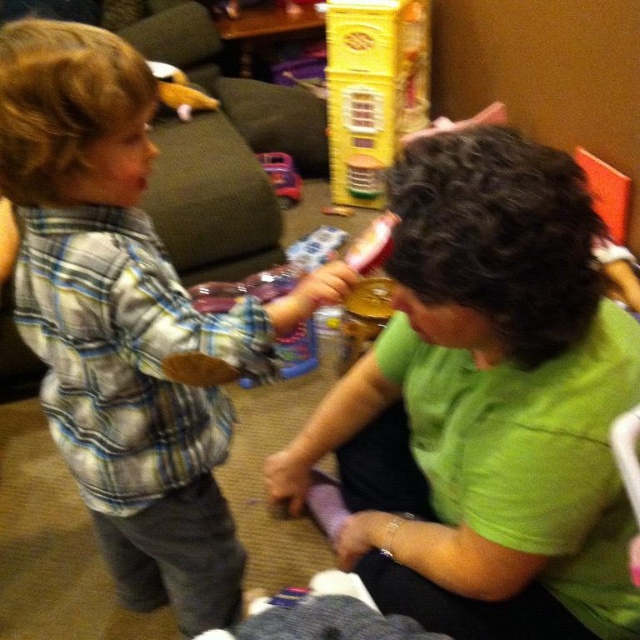
Question: Which of these objects is positioned closest to the plastic toy car at center?

Choices:
 (A) yellow plastic dollhouse at upper center
 (B) plaid cotton shirt at left
 (C) green matte shirt at center

Answer: (A)

Question: Which point appears closest to the camera in this image?

Choices:
 (A) (554, 504)
 (B) (365, 202)
 (C) (144, 538)
 (D) (275, 152)

Answer: (A)

Question: Is plaid cotton shirt at left bigger than yellow plastic dollhouse at upper center?

Choices:
 (A) no
 (B) yes

Answer: (B)

Question: Which object is the closest to the yellow plastic dollhouse at upper center?

Choices:
 (A) green matte shirt at center
 (B) plaid cotton shirt at left
 (C) plastic toy car at center

Answer: (C)

Question: Considering the relative positions of plaid cotton shirt at left and plastic toy car at center in the image provided, where is plaid cotton shirt at left located with respect to plastic toy car at center?

Choices:
 (A) left
 (B) right

Answer: (A)

Question: Is plaid cotton shirt at left thinner than plastic toy car at center?

Choices:
 (A) no
 (B) yes

Answer: (A)